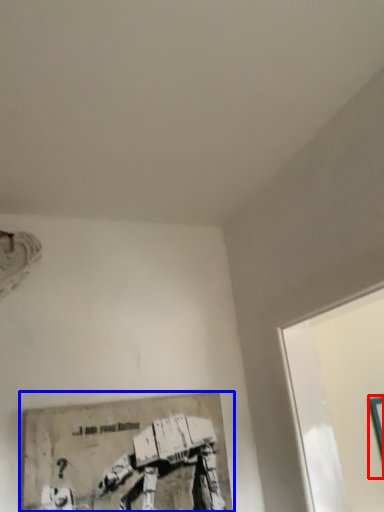
Question: Which object is closer to the camera taking this photo, picture frame (highlighted by a red box) or picture frame (highlighted by a blue box)?

Choices:
 (A) picture frame
 (B) picture frame

Answer: (B)